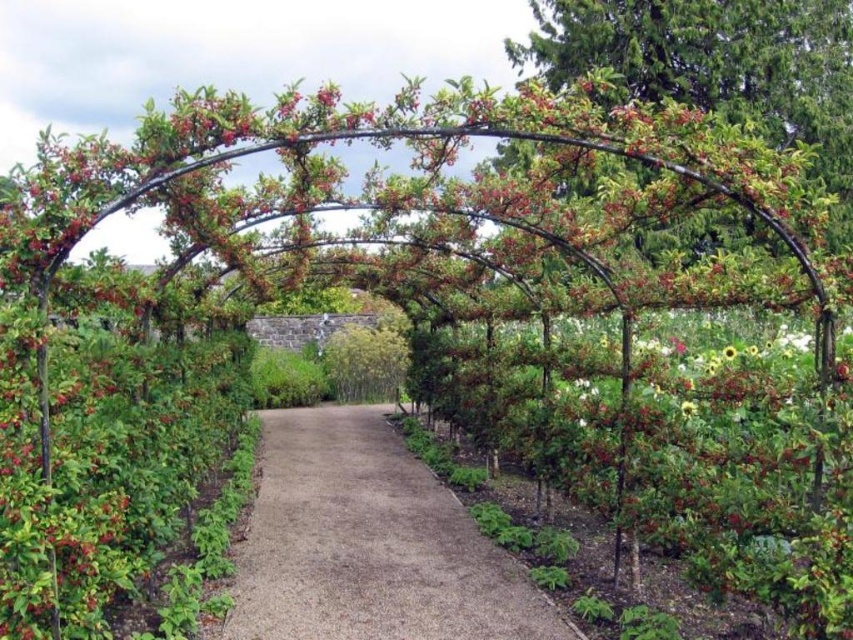
Question: Does green leafy bush at center have a greater width compared to yellow matte sunflower at center-right?

Choices:
 (A) no
 (B) yes

Answer: (B)

Question: Does brown gravel path at center come behind green leafy bush at center?

Choices:
 (A) yes
 (B) no

Answer: (B)

Question: Can you confirm if brown gravel path at center is wider than green leafy bush at center?

Choices:
 (A) yes
 (B) no

Answer: (A)

Question: Among these points, which one is nearest to the camera?

Choices:
 (A) (340, 358)
 (B) (683, 404)
 (C) (363, 468)

Answer: (B)

Question: Among these objects, which one is nearest to the camera?

Choices:
 (A) green leafy bush at center
 (B) yellow matte sunflower at center-right
 (C) brown gravel path at center

Answer: (B)

Question: Which object is positioned closest to the green leafy bush at center?

Choices:
 (A) brown gravel path at center
 (B) yellow matte sunflower at center-right

Answer: (A)